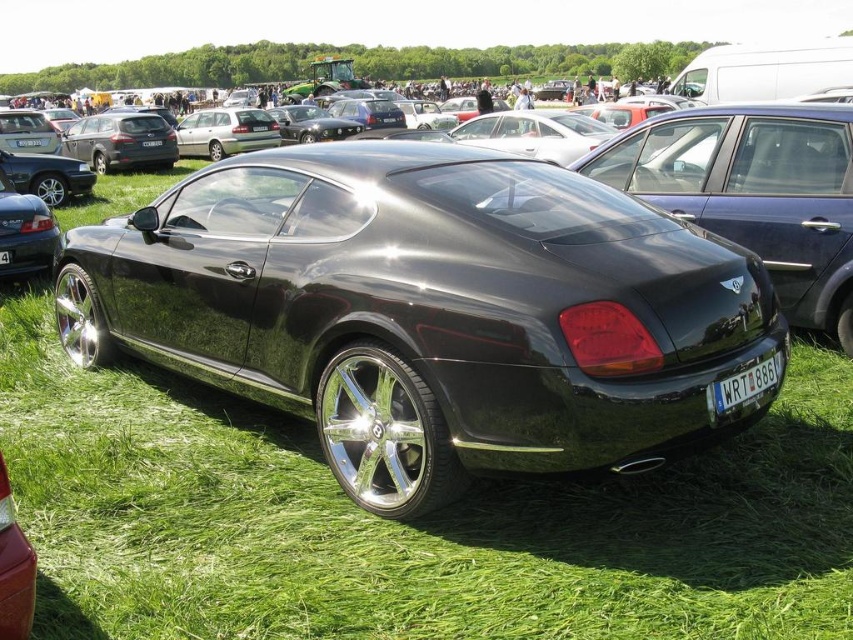
Is the position of shiny black car at center more distant than that of white plastic license plate at center?

No.

Is shiny black car at center to the left of white plastic license plate at center from the viewer's perspective?

In fact, shiny black car at center is to the right of white plastic license plate at center.

Who is more distant from viewer, (822, 480) or (149, 140)?

The point (149, 140) is more distant.

The width and height of the screenshot is (853, 640). In order to click on shiny black car at center in this screenshot , I will do `click(405, 525)`.

Is white plastic license plate at lower center closer to camera compared to white plastic license plate at center?

Yes, white plastic license plate at lower center is in front of white plastic license plate at center.

Does point (741, 401) come in front of point (149, 145)?

That is True.

Where is `white plastic license plate at lower center`? white plastic license plate at lower center is located at coordinates (746, 384).

Who is more distant from viewer, (26, 486) or (262, 120)?

The point (262, 120) is behind.

Is point (6, 406) positioned behind point (207, 125)?

No, (6, 406) is in front of (207, 125).

Locate an element on the screen. shiny black car at center is located at coordinates (405, 525).